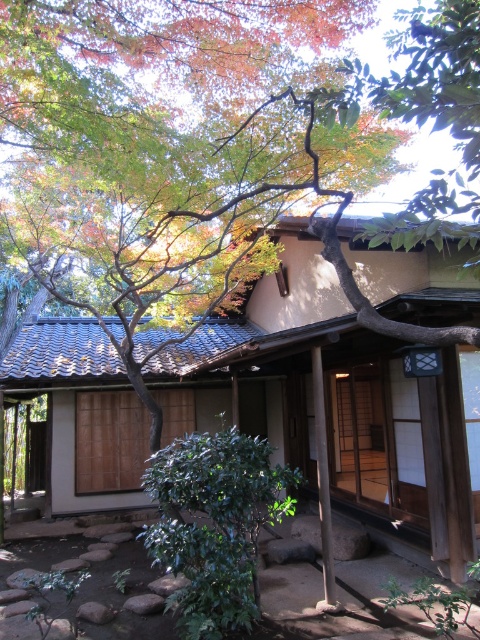
You are a visitor standing in the garden of the traditional Japanese house. You see the beige wooden hut at center and the green leafy bush at center. Which object is higher up in the image?

The beige wooden hut at center is above the green leafy bush at center, so the beige wooden hut at center is higher up in the image.

You are planning to place a new decorative item in the garden. The beige wooden hut at center and the green leafy bush at center are both in the same area. Which object should you consider for placement if you need more space around it?

The beige wooden hut at center is wider than the green leafy bush at center, so placing the decorative item near the beige wooden hut at center would require more space around it.

You are standing at the entrance of the traditional Japanese house and see two points marked in the garden. Which point is closer to you, point (334, 440) or point (244, 445)?

Point (244, 445) is closer to you because point (334, 440) is behind it.